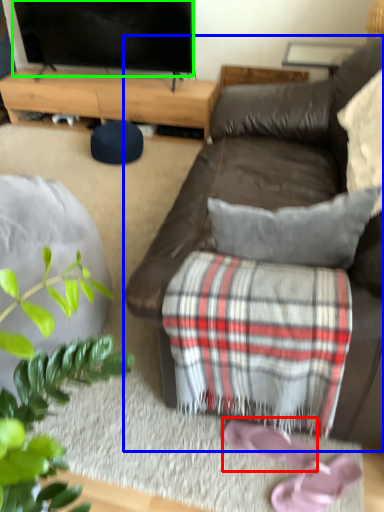
Question: Considering the real-world distances, which object is farthest from shoe (highlighted by a red box)? studio couch (highlighted by a blue box) or television (highlighted by a green box)?

Choices:
 (A) studio couch
 (B) television

Answer: (B)